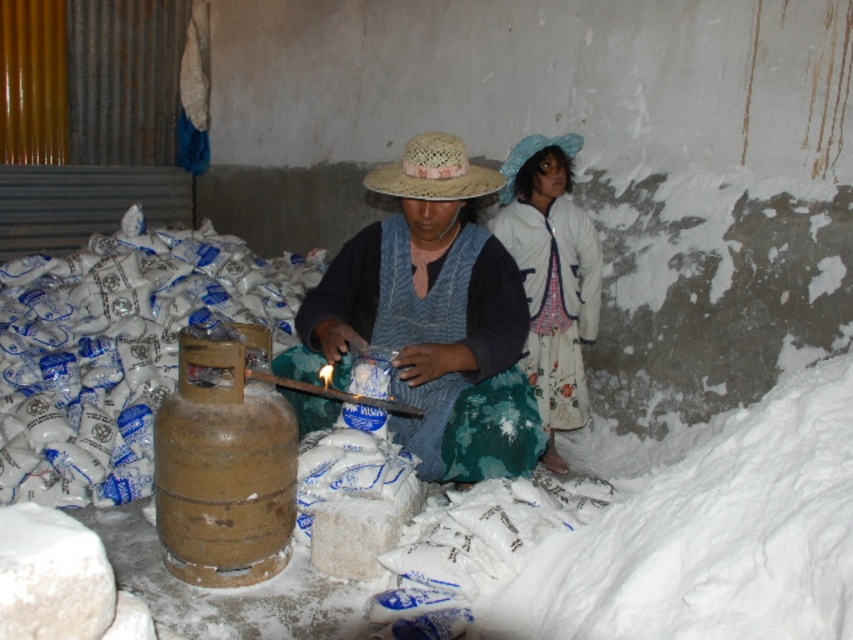
What do you see at coordinates (434, 316) in the screenshot? The image size is (853, 640). I see `knitted straw hat at center` at bounding box center [434, 316].

Is knitted straw hat at center to the left of straw hat at center from the viewer's perspective?

Yes, knitted straw hat at center is to the left of straw hat at center.

Which is in front, point (463, 188) or point (418, 189)?

Point (418, 189) is more forward.

At what (x,y) coordinates should I click in order to perform the action: click on knitted straw hat at center. Please return your answer as a coordinate pair (x, y). This screenshot has height=640, width=853. Looking at the image, I should click on (434, 316).

Does knitted straw hat at center come behind white cotton dress at upper right?

No, it is not.

Consider the image. Can you confirm if knitted straw hat at center is positioned below white cotton dress at upper right?

Indeed, knitted straw hat at center is positioned under white cotton dress at upper right.

What do you see at coordinates (434, 316) in the screenshot? The image size is (853, 640). I see `knitted straw hat at center` at bounding box center [434, 316].

The height and width of the screenshot is (640, 853). I want to click on knitted straw hat at center, so click(434, 316).

Can you confirm if white cotton dress at upper right is taller than straw hat at center?

Correct, white cotton dress at upper right is much taller as straw hat at center.

What do you see at coordinates (550, 275) in the screenshot?
I see `white cotton dress at upper right` at bounding box center [550, 275].

I want to click on white cotton dress at upper right, so click(x=550, y=275).